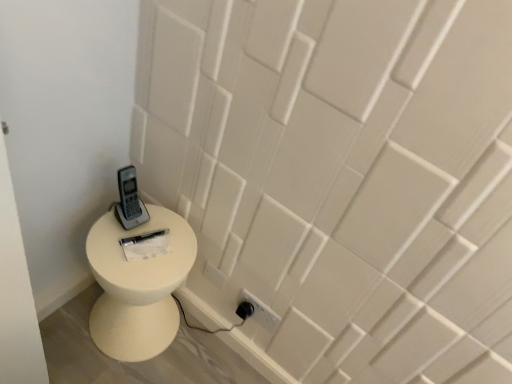
At what (x,y) coordinates should I click in order to perform the action: click on white matte toilet at lower left. Please return your answer as a coordinate pair (x, y). Looking at the image, I should click on (137, 287).

This screenshot has height=384, width=512. What do you see at coordinates (137, 287) in the screenshot?
I see `white matte toilet at lower left` at bounding box center [137, 287].

The height and width of the screenshot is (384, 512). Describe the element at coordinates (129, 200) in the screenshot. I see `gray plastic phone at upper left` at that location.

Locate an element on the screen. gray plastic phone at upper left is located at coordinates (129, 200).

Locate an element on the screen. This screenshot has height=384, width=512. white matte toilet at lower left is located at coordinates (137, 287).

Which object is positioned more to the right, white matte toilet at lower left or gray plastic phone at upper left?

gray plastic phone at upper left.

Is white matte toilet at lower left positioned behind gray plastic phone at upper left?

No, it is in front of gray plastic phone at upper left.

Which is closer to the camera, [161,211] or [139,207]?

The point [139,207] is in front.

In the scene shown: From the image's perspective, would you say white matte toilet at lower left is positioned over gray plastic phone at upper left?

No, from the image's perspective, white matte toilet at lower left is not on top of gray plastic phone at upper left.

From a real-world perspective, who is located lower, white matte toilet at lower left or gray plastic phone at upper left?

In real-world perspective, white matte toilet at lower left is lower.

Does white matte toilet at lower left have a greater width compared to gray plastic phone at upper left?

Yes.

Considering the relative sizes of white matte toilet at lower left and gray plastic phone at upper left in the image provided, is white matte toilet at lower left taller than gray plastic phone at upper left?

Yes, white matte toilet at lower left is taller than gray plastic phone at upper left.

Between white matte toilet at lower left and gray plastic phone at upper left, which one has larger size?

Bigger between the two is white matte toilet at lower left.

Is white matte toilet at lower left situated inside gray plastic phone at upper left or outside?

white matte toilet at lower left is located beyond the bounds of gray plastic phone at upper left.

Is white matte toilet at lower left not close to gray plastic phone at upper left?

Actually, white matte toilet at lower left and gray plastic phone at upper left are a little close together.

Is white matte toilet at lower left facing away from gray plastic phone at upper left?

No, white matte toilet at lower left's orientation is not away from gray plastic phone at upper left.

How different are the orientations of white matte toilet at lower left and gray plastic phone at upper left in degrees?

white matte toilet at lower left and gray plastic phone at upper left are facing 10.2 degrees away from each other.

This screenshot has height=384, width=512. I want to click on control behind the white matte toilet at lower left, so click(129, 200).

Is gray plastic phone at upper left to the left or to the right of white matte toilet at lower left in the image?

Based on their positions, gray plastic phone at upper left is located to the right of white matte toilet at lower left.

Is gray plastic phone at upper left closer to the viewer compared to white matte toilet at lower left?

No, gray plastic phone at upper left is further to the viewer.

Considering the points (134, 168) and (182, 273), which point is behind, point (134, 168) or point (182, 273)?

The point (134, 168) is more distant.

From the image's perspective, between gray plastic phone at upper left and white matte toilet at lower left, who is located below?

From the image's view, white matte toilet at lower left is below.

From a real-world perspective, between gray plastic phone at upper left and white matte toilet at lower left, who is vertically higher?

gray plastic phone at upper left is physically above.

Does gray plastic phone at upper left have a lesser width compared to white matte toilet at lower left?

Yes, gray plastic phone at upper left is thinner than white matte toilet at lower left.

Who is taller, gray plastic phone at upper left or white matte toilet at lower left?

white matte toilet at lower left is taller.

Considering the relative sizes of gray plastic phone at upper left and white matte toilet at lower left in the image provided, is gray plastic phone at upper left bigger than white matte toilet at lower left?

No, gray plastic phone at upper left is not bigger than white matte toilet at lower left.

Is white matte toilet at lower left surrounded by gray plastic phone at upper left?

That's incorrect, white matte toilet at lower left is not inside gray plastic phone at upper left.

Is gray plastic phone at upper left placed right next to white matte toilet at lower left?

No, gray plastic phone at upper left is not next to white matte toilet at lower left.

Is gray plastic phone at upper left facing towards white matte toilet at lower left?

No, gray plastic phone at upper left is not facing towards white matte toilet at lower left.

Can you tell me how much gray plastic phone at upper left and white matte toilet at lower left differ in facing direction?

10.2 degrees separate the facing orientations of gray plastic phone at upper left and white matte toilet at lower left.

How distant is gray plastic phone at upper left from white matte toilet at lower left?

The distance of gray plastic phone at upper left from white matte toilet at lower left is 8.26 inches.

Locate an element on the screen. The image size is (512, 384). toilet on the left of the gray plastic phone at upper left is located at coordinates (137, 287).

Locate an element on the screen. toilet beneath the gray plastic phone at upper left (from a real-world perspective) is located at coordinates (137, 287).

In the image, there is a gray plastic phone at upper left. Where is `toilet below it (from the image's perspective)`? toilet below it (from the image's perspective) is located at coordinates (137, 287).